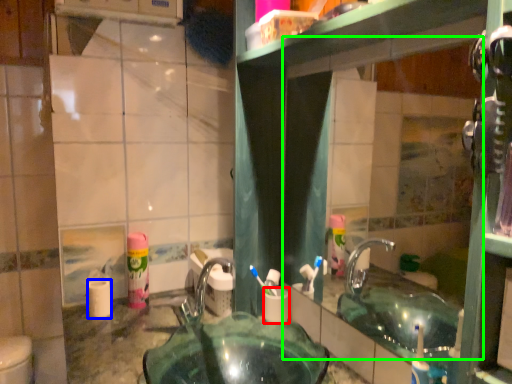
Question: Considering the real-world distances, which object is closest to toilet paper (highlighted by a red box)? toilet paper (highlighted by a blue box) or mirror (highlighted by a green box).

Choices:
 (A) toilet paper
 (B) mirror

Answer: (A)